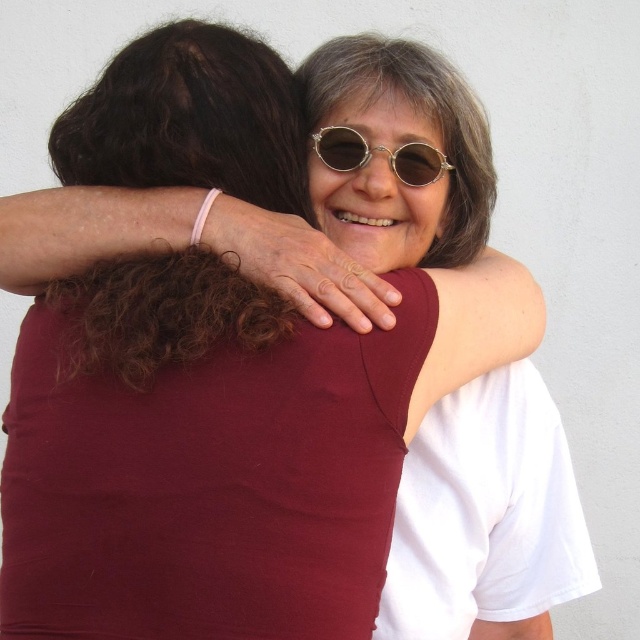
Question: Does pink rubber band at upper center have a larger size compared to gold metallic sunglasses at center?

Choices:
 (A) yes
 (B) no

Answer: (A)

Question: Is pink rubber band at upper center behind gold metallic sunglasses at center?

Choices:
 (A) yes
 (B) no

Answer: (B)

Question: Can you confirm if pink rubber band at upper center is smaller than gold metallic sunglasses at center?

Choices:
 (A) no
 (B) yes

Answer: (A)

Question: Among these objects, which one is farthest from the camera?

Choices:
 (A) pink rubber band at upper center
 (B) gold metallic sunglasses at center

Answer: (B)

Question: Among these objects, which one is nearest to the camera?

Choices:
 (A) gold metallic sunglasses at center
 (B) pink rubber band at upper center

Answer: (B)